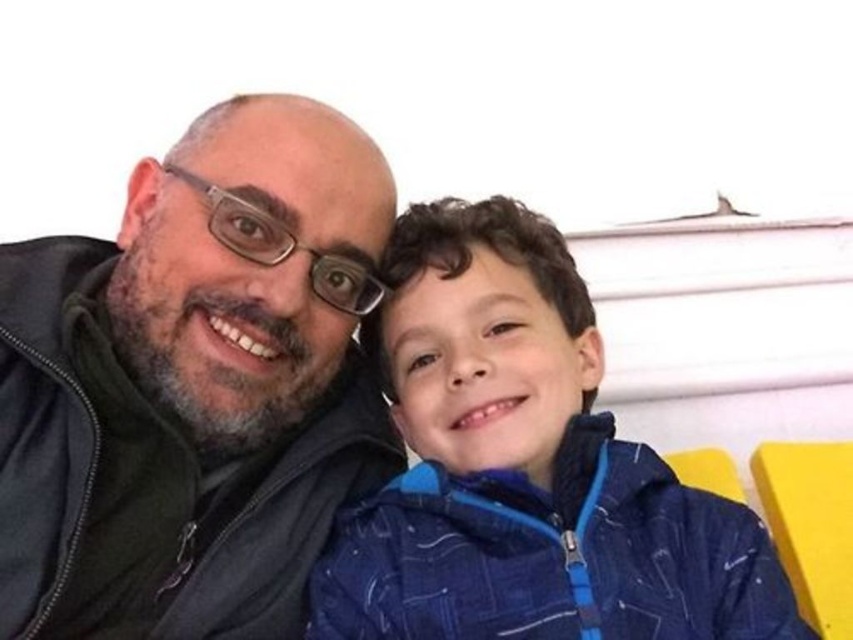
Question: Can you confirm if matte black jacket at left is positioned to the left of blue textured jacket at center?

Choices:
 (A) no
 (B) yes

Answer: (B)

Question: Can you confirm if matte black jacket at left is thinner than blue textured jacket at center?

Choices:
 (A) no
 (B) yes

Answer: (B)

Question: Which object appears closest to the camera in this image?

Choices:
 (A) matte black jacket at left
 (B) blue textured jacket at center

Answer: (B)

Question: Which point appears farthest from the camera in this image?

Choices:
 (A) (345, 461)
 (B) (370, 637)

Answer: (A)

Question: Can you confirm if matte black jacket at left is positioned above blue textured jacket at center?

Choices:
 (A) yes
 (B) no

Answer: (A)